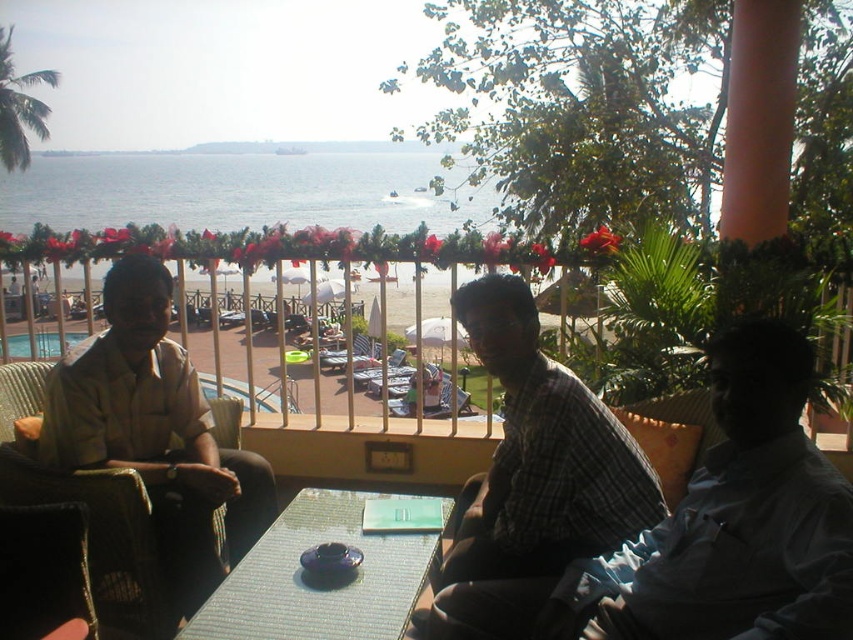
Question: Which object is positioned farthest from the plaid fabric shirt at center?

Choices:
 (A) matte beige shirt at left
 (B) dark gray shirt at right
 (C) translucent glass table at center

Answer: (A)

Question: In this image, where is dark gray shirt at right located relative to plaid fabric shirt at center?

Choices:
 (A) above
 (B) below

Answer: (A)

Question: Does dark gray shirt at right come behind plaid fabric shirt at center?

Choices:
 (A) yes
 (B) no

Answer: (B)

Question: Which object is farther from the camera taking this photo?

Choices:
 (A) matte beige shirt at left
 (B) dark gray shirt at right
 (C) translucent glass table at center

Answer: (A)

Question: Which point is closer to the camera?

Choices:
 (A) (790, 467)
 (B) (45, 419)
 (C) (250, 618)
 (D) (590, 534)

Answer: (A)

Question: Does dark gray shirt at right appear over matte beige shirt at left?

Choices:
 (A) no
 (B) yes

Answer: (A)